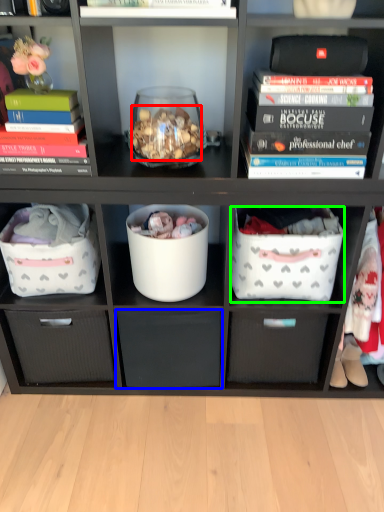
Question: Estimate the real-world distances between objects in this image. Which object is closer to stuff (highlighted by a red box), drawer (highlighted by a blue box) or laundry basket (highlighted by a green box)?

Choices:
 (A) drawer
 (B) laundry basket

Answer: (B)